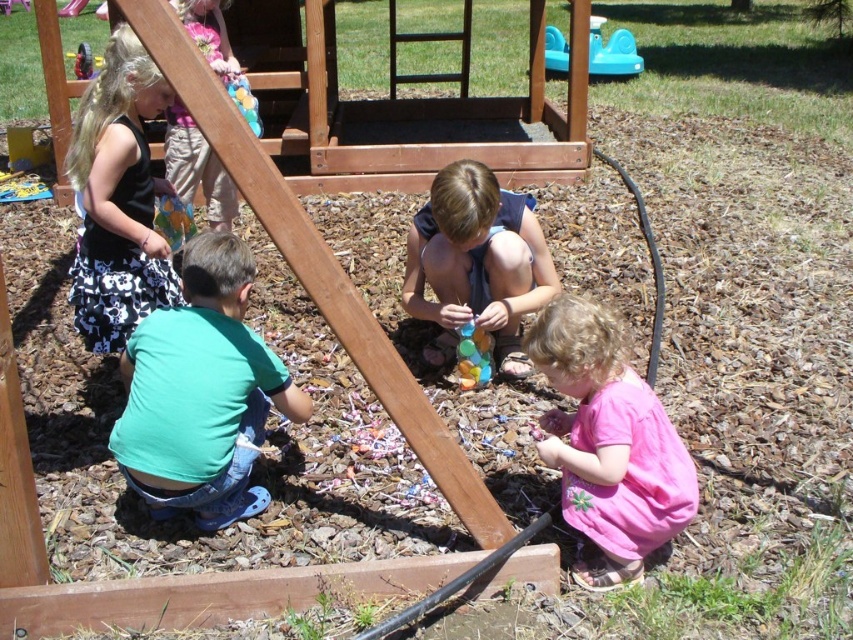
Question: Observing the image, what is the correct spatial positioning of teal plastic toy at upper right in reference to wooden swing at upper left?

Choices:
 (A) above
 (B) below

Answer: (A)

Question: Which point is closer to the camera?

Choices:
 (A) pink cotton dress at lower right
 (B) wooden swing at upper left

Answer: (A)

Question: Is matte pink dress at upper left above translucent plastic beads at center?

Choices:
 (A) no
 (B) yes

Answer: (B)

Question: Which object is positioned closest to the black floral skirt at upper left?

Choices:
 (A) shiny blue beads at center
 (B) matte pink dress at upper left

Answer: (B)

Question: Considering the real-world distances, which object is farthest from the teal plastic toy at upper right?

Choices:
 (A) shiny blue beads at center
 (B) translucent plastic beads at center
 (C) black floral skirt at upper left

Answer: (C)

Question: Does black floral skirt at upper left have a lesser width compared to wooden swing at upper left?

Choices:
 (A) yes
 (B) no

Answer: (B)